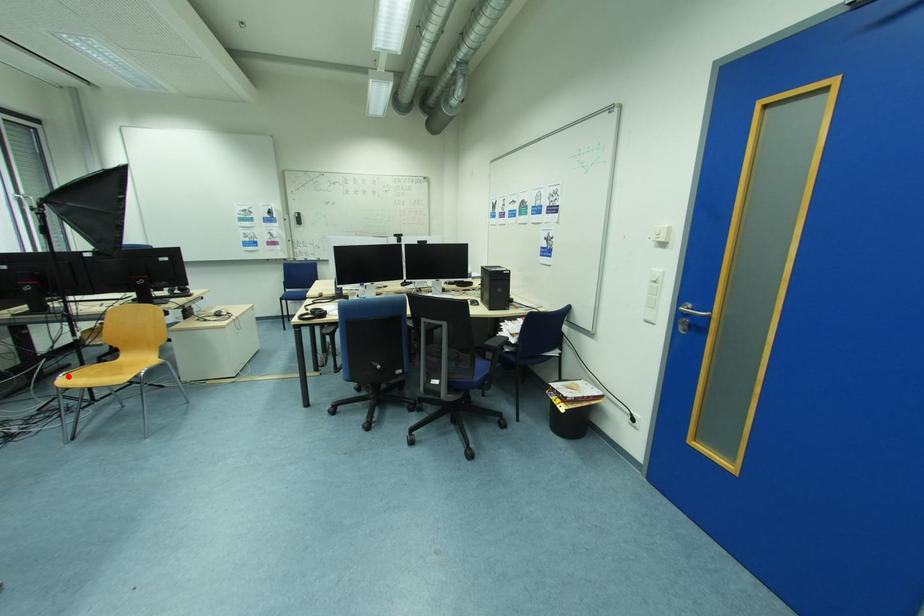
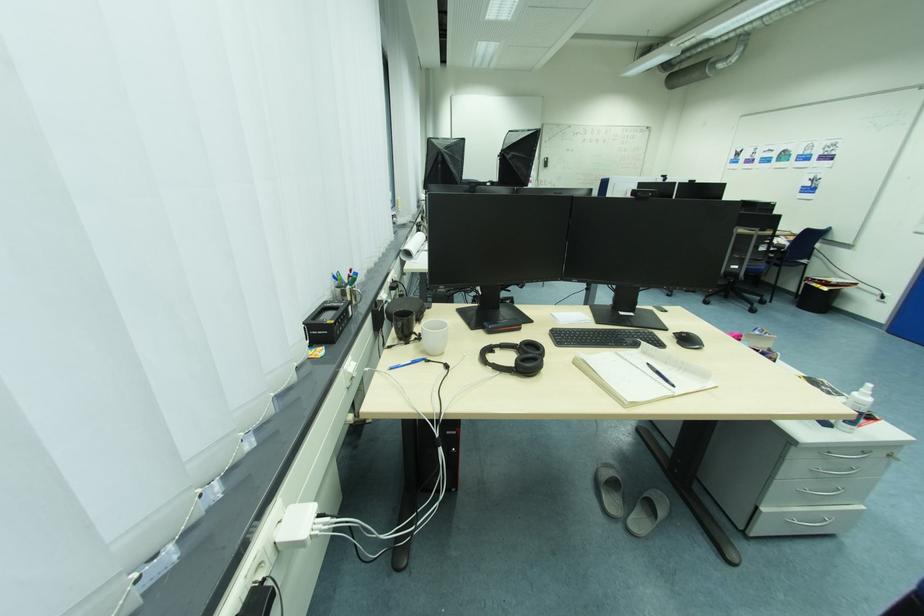
Question: I am providing you with two images of the same scene from different viewpoints. A red point is marked on the first image. At the location where the point appears in image 1, is it still visible in image 2?

Choices:
 (A) Yes
 (B) No

Answer: (B)